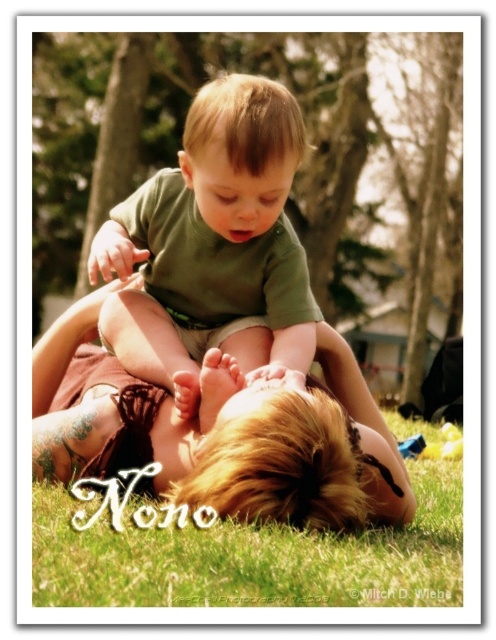
Question: Does brown leather boots at lower center have a greater width compared to green matte shirt at center?

Choices:
 (A) yes
 (B) no

Answer: (A)

Question: Which point is closer to the camera?

Choices:
 (A) (417, 529)
 (B) (117, 442)

Answer: (B)

Question: Is brown leather boots at lower center thinner than green matte shirt at center?

Choices:
 (A) no
 (B) yes

Answer: (A)

Question: Does brown leather boots at lower center have a lesser width compared to green matte shirt at center?

Choices:
 (A) yes
 (B) no

Answer: (B)

Question: Among these points, which one is nearest to the camera?

Choices:
 (A) (236, 308)
 (B) (125, 534)
 (C) (62, 332)

Answer: (B)

Question: Which point is farther from the camera taking this photo?

Choices:
 (A) (175, 544)
 (B) (378, 486)
 (C) (224, 148)

Answer: (B)